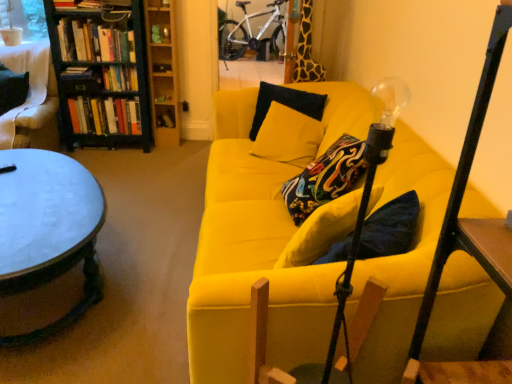
Identify the location of vacant space behind metallic round table at left. (143, 190).